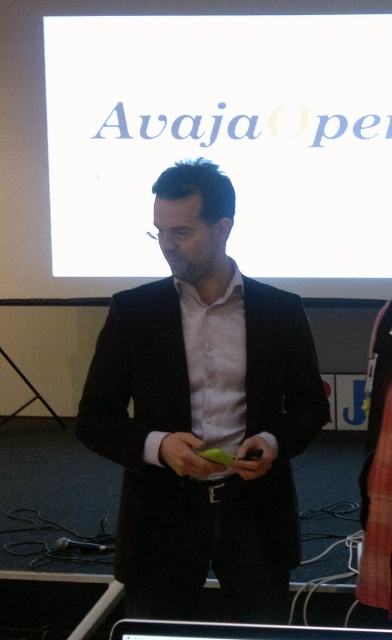
You are a photographer standing at the camera position. You need to adjust your focus to capture a sharp image of the point at coordinates point (277, 100). What is the minimum distance you need to set your focus to in meters?

The distance of point (277, 100) from the camera is 3.78 meters, so you need to set your focus to at least 3.78 meters to capture it sharply.

You are an event organizer checking the setup for a presentation. You need to ensure that the white matte projection screen at upper center and the black matte suit at center are positioned correctly. Based on the scene description, which object is larger in size?

The white matte projection screen at upper center is larger in size than the black matte suit at center.